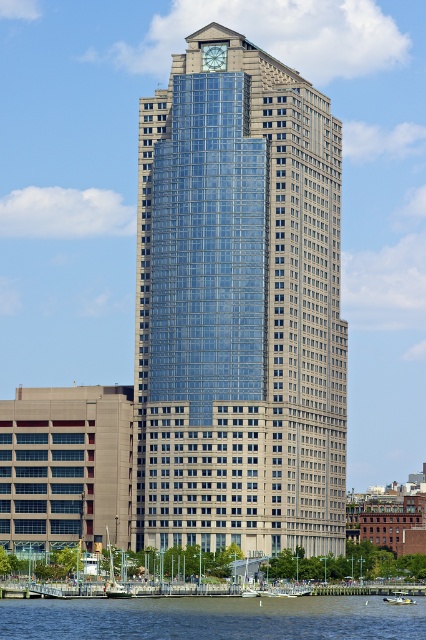
Does blue water at lower center have a smaller size compared to white wooden sailboat at lower center?

Actually, blue water at lower center might be larger than white wooden sailboat at lower center.

From the picture: Does blue water at lower center come behind white wooden sailboat at lower center?

No, blue water at lower center is closer to the viewer.

What do you see at coordinates (212, 618) in the screenshot?
I see `blue water at lower center` at bounding box center [212, 618].

At what (x,y) coordinates should I click in order to perform the action: click on blue water at lower center. Please return your answer as a coordinate pair (x, y). The height and width of the screenshot is (640, 426). Looking at the image, I should click on (212, 618).

Between point (311, 636) and point (258, 593), which one is positioned in front?

Positioned in front is point (311, 636).

The image size is (426, 640). In order to click on blue water at lower center in this screenshot , I will do `click(212, 618)`.

Find the location of a particular element. The image size is (426, 640). blue water at lower center is located at coordinates (212, 618).

In the scene shown: Who is more distant from viewer, (x=126, y=593) or (x=396, y=595)?

Point (x=396, y=595)

Is white wooden sailboat at lower center smaller than green plastic boat at lower right?

No, white wooden sailboat at lower center is not smaller than green plastic boat at lower right.

What do you see at coordinates (114, 577) in the screenshot?
I see `white wooden sailboat at lower center` at bounding box center [114, 577].

Locate an element on the screen. white wooden sailboat at lower center is located at coordinates (114, 577).